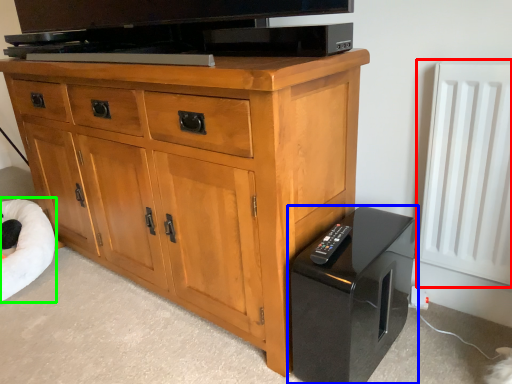
Question: Which object is positioned farthest from radiator (highlighted by a red box)? Select from home appliance (highlighted by a blue box) and bean bag chair (highlighted by a green box).

Choices:
 (A) home appliance
 (B) bean bag chair

Answer: (B)